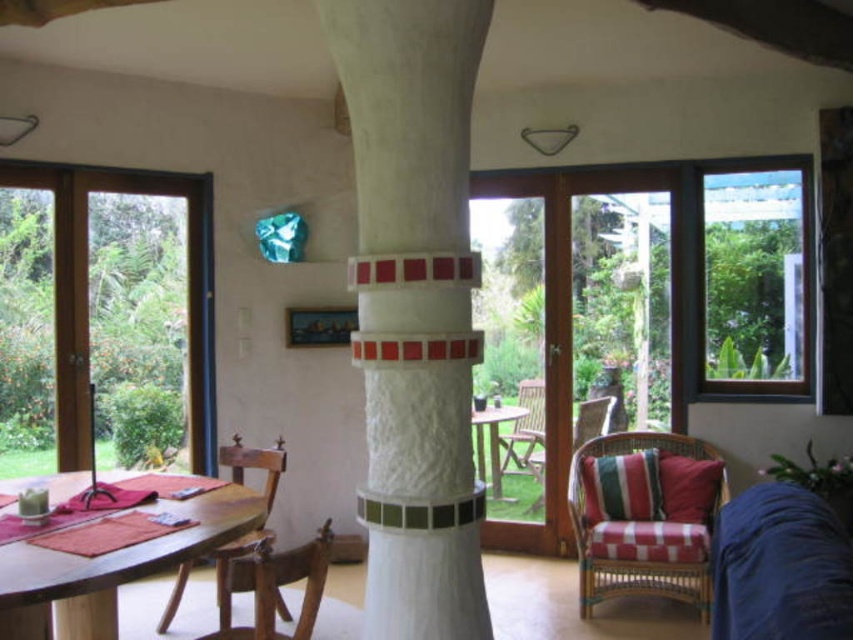
Question: Is wooden chair at lower left wider than wooden table at center?

Choices:
 (A) no
 (B) yes

Answer: (B)

Question: Which of the following is the closest to the observer?

Choices:
 (A) wooden table at center
 (B) striped fabric armchair at lower right
 (C) wooden armchair at lower left
 (D) wooden chair at lower left

Answer: (C)

Question: Which object is closer to the camera taking this photo?

Choices:
 (A) wooden chair at lower left
 (B) wooden table at center
 (C) woven rattan armchair at lower right
 (D) wooden table at lower left

Answer: (D)

Question: Can you confirm if wooden table at lower left is positioned below wooden table at center?

Choices:
 (A) no
 (B) yes

Answer: (B)

Question: Is wooden table at lower left above wooden chair at lower left?

Choices:
 (A) no
 (B) yes

Answer: (B)

Question: Which is nearer to the wooden chair at lower left?

Choices:
 (A) wooden armchair at lower left
 (B) white textured column at center
 (C) striped fabric armchair at center

Answer: (A)